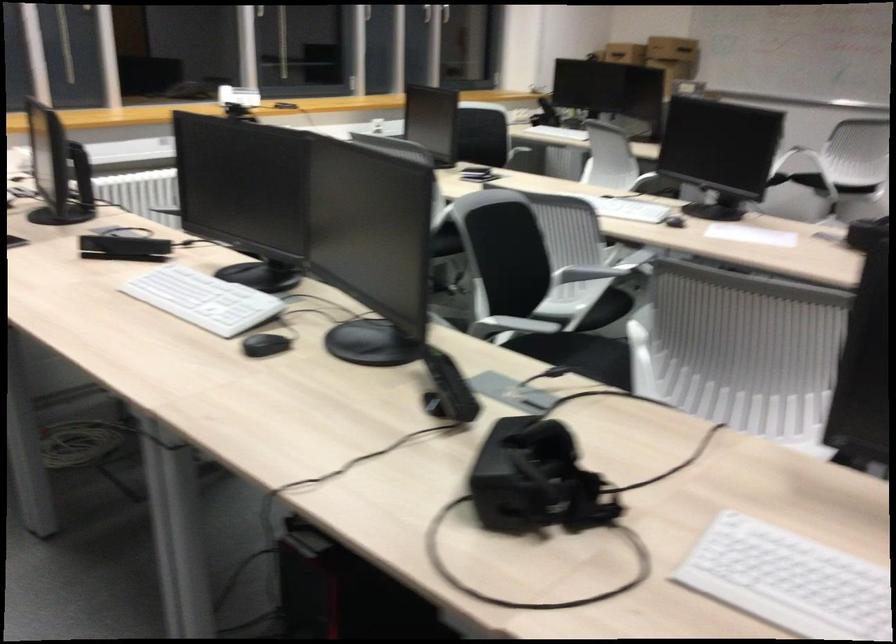
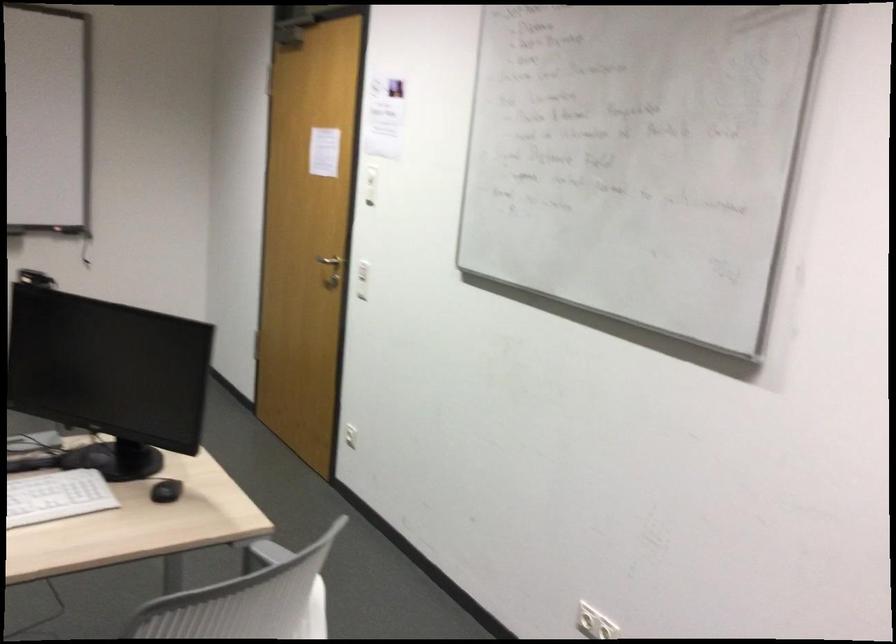
Question: The camera is either moving clockwise (left) or counter-clockwise (right) around the object. The first image is from the beginning of the video and the second image is from the end. Is the camera moving left or right when shooting the video?

Choices:
 (A) Left
 (B) Right

Answer: (A)